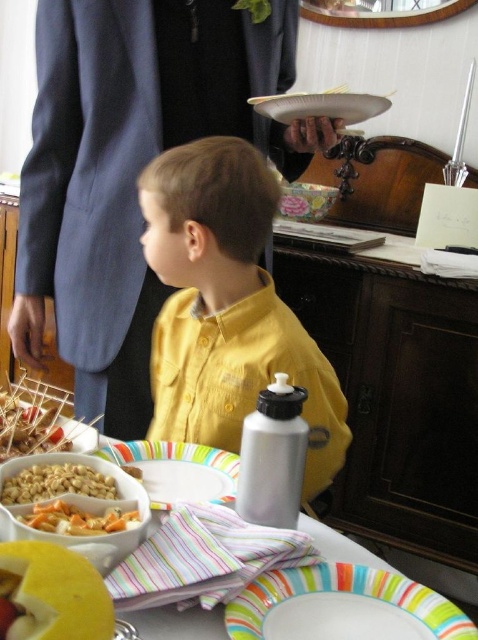
Who is positioned more to the left, yellow matte shirt at center or striped paper plate at center?

striped paper plate at center

Is yellow matte shirt at center behind striped paper plate at center?

Yes.

Identify the location of yellow matte shirt at center. (227, 307).

Identify the location of yellow matte shirt at center. The height and width of the screenshot is (640, 478). coord(227,307).

The image size is (478, 640). What are the coordinates of `white paper plate at center` in the screenshot? It's located at (254, 572).

Is white paper plate at center thinner than carrot salad at lower left?

No, white paper plate at center is not thinner than carrot salad at lower left.

What are the coordinates of `white paper plate at center` in the screenshot? It's located at (254, 572).

Locate an element on the screen. white paper plate at center is located at coordinates (254, 572).

Is crumbly brown cookie at left further to the viewer compared to carrot salad at lower left?

Yes, crumbly brown cookie at left is further from the viewer.

Does point (62, 449) lie behind point (51, 529)?

Yes, it is behind point (51, 529).

You are a GUI agent. You are given a task and a screenshot of the screen. Output one action in this format:
    pyautogui.click(x=<x>, y=<y>)
    Task: Click on the crumbly brown cookie at left
    The image size is (478, 640).
    Given the screenshot: What is the action you would take?
    pyautogui.click(x=29, y=424)